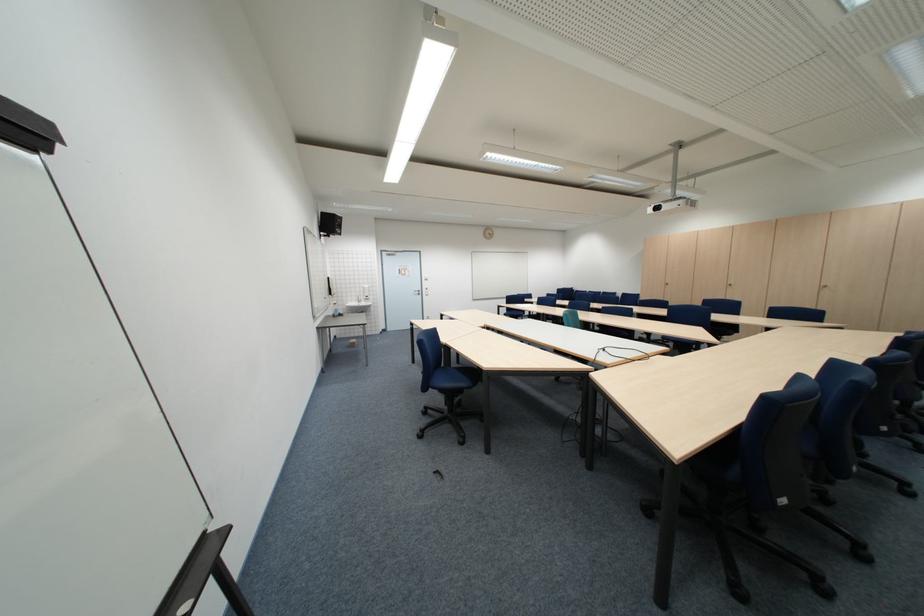
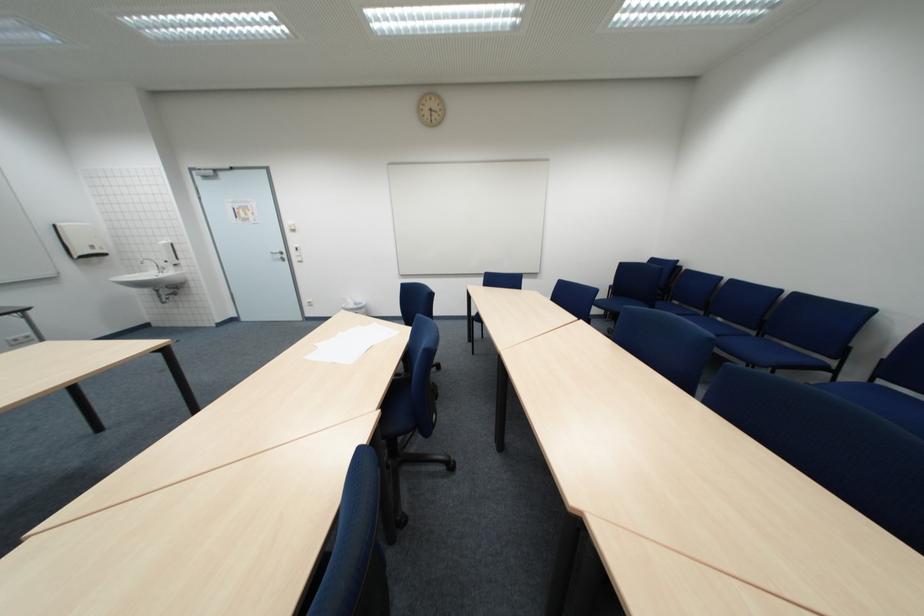
The point at (433, 294) is marked in the first image. Where is the corresponding point in the second image?

(299, 257)